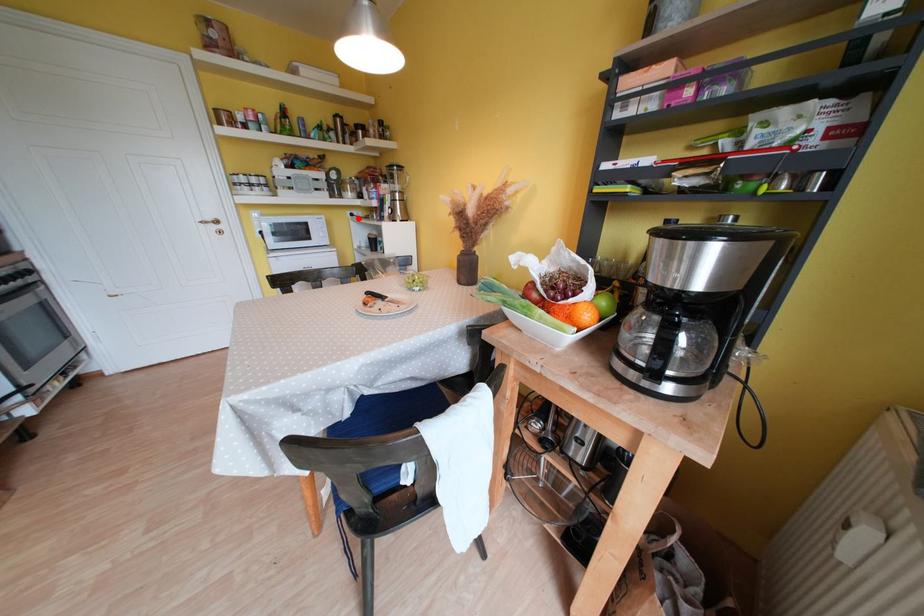
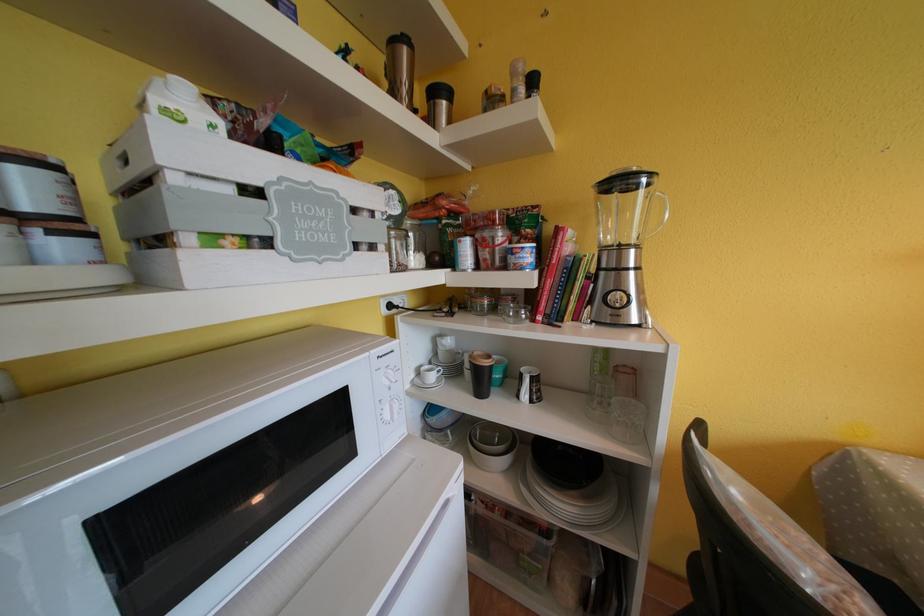
Where in the second image is the point corresponding to the highlighted location from the first image?

(396, 310)